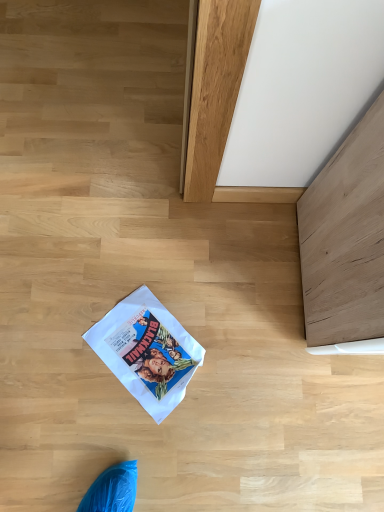
Identify the location of vacant space to the right of white paper at center. (236, 369).